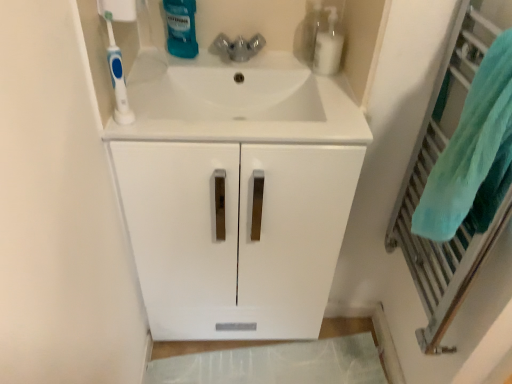
The image size is (512, 384). Identify the location of free space on the front side of translucent plastic mouthwash at upper center, the first cleaning product positioned from the left. (162, 76).